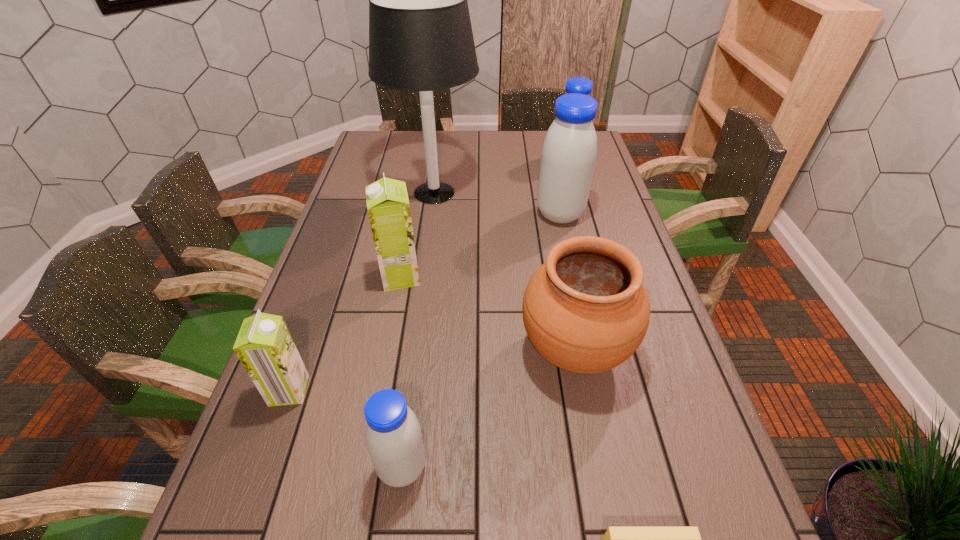
Find the location of a particular element. This screenshot has width=960, height=540. table lamp is located at coordinates (420, 35).

I want to click on the fourth nearest soya milk, so click(x=569, y=151).

Find the location of `the second nearest blue soya milk`. the second nearest blue soya milk is located at coordinates (569, 151).

Find the location of a particular element. Image resolution: width=960 pixels, height=540 pixels. the third nearest soya milk is located at coordinates (388, 207).

The width and height of the screenshot is (960, 540). I want to click on the bigger green soya milk, so click(x=388, y=207).

The width and height of the screenshot is (960, 540). Find the location of `the farthest blue soya milk`. the farthest blue soya milk is located at coordinates (581, 85).

The image size is (960, 540). I want to click on the second smallest blue soya milk, so click(581, 85).

At what (x,y) coordinates should I click in order to perform the action: click on pottery. Please return your answer as a coordinate pair (x, y). The height and width of the screenshot is (540, 960). Looking at the image, I should click on (585, 310).

Locate an element on the screen. the second nearest soya milk is located at coordinates (264, 346).

The image size is (960, 540). In order to click on the leftmost object in this screenshot , I will do `click(264, 346)`.